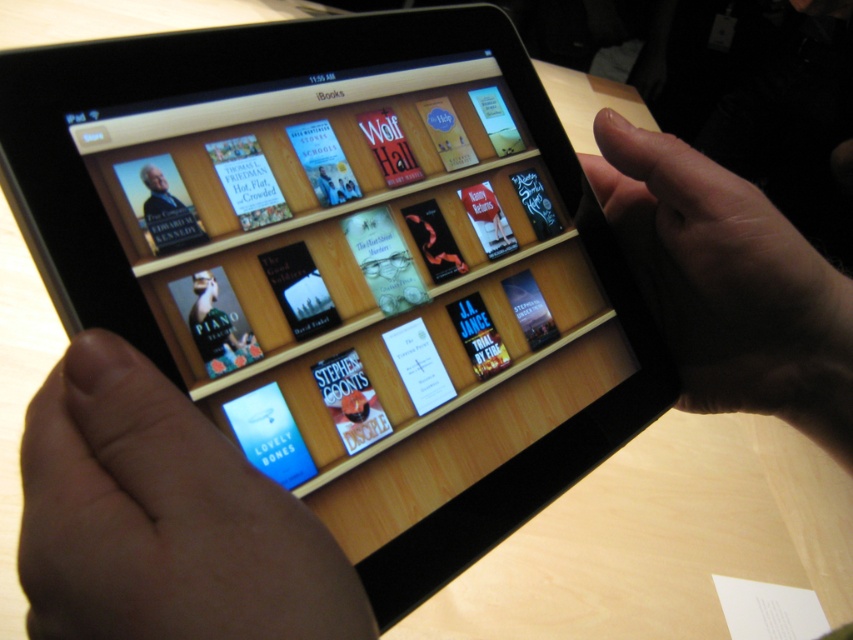
You are a virtual assistant trying to guide a user to select a book from the iPad. You notice the smooth skin hand at lower left and the skinny finger at upper right. Which object has a smaller width?

The smooth skin hand at lower left has a lesser width compared to the skinny finger at upper right.

You are a virtual assistant trying to help the user navigate the iBooks app. The user wants to know if their hand is near the bottom of the screen. Based on the coordinates provided, can you confirm if the smooth skin hand at lower left is near the bottom of the iPad screen?

The smooth skin hand at lower left is located at point (161, 518). Since the y coordinate is 0.191, which is closer to the bottom of the screen, the hand is near the bottom of the iPad screen.